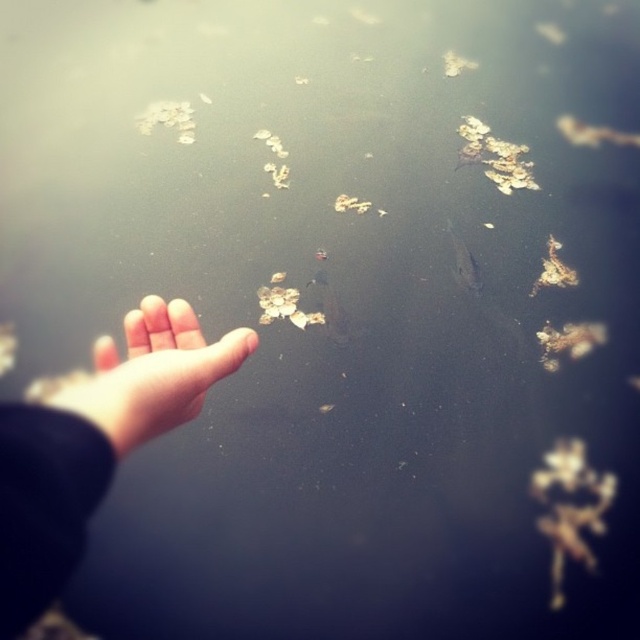
You are a photographer trying to capture the exact position of the objects in the scene. According to the image, is the skinny flesh at left located to the left or right side of the pale skin hand at lower left?

The skinny flesh at left is to the left of the pale skin hand at lower left, so it is positioned to the left side of the hand.

In the scene, you see a skinny flesh at left and brown organic matter at center. Which object is bigger in size?

The skinny flesh at left is larger in size compared to the brown organic matter at center.

You are an artist observing the scene. You want to sketch the relative positions of the pale skin hand at lower left and the brown leafy debris at upper center. Which object is closer to the bottom edge of the image?

The pale skin hand at lower left is closer to the bottom edge of the image because it is positioned at the lower left, while the brown leafy debris at upper center is located at the upper center.